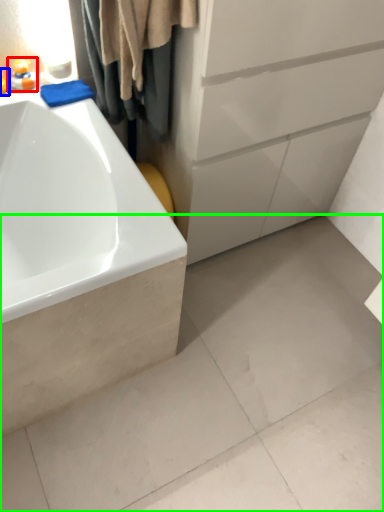
Question: Based on their relative distances, which object is farther from toy (highlighted by a red box)? Choose from toy (highlighted by a blue box) and concrete (highlighted by a green box).

Choices:
 (A) toy
 (B) concrete

Answer: (B)